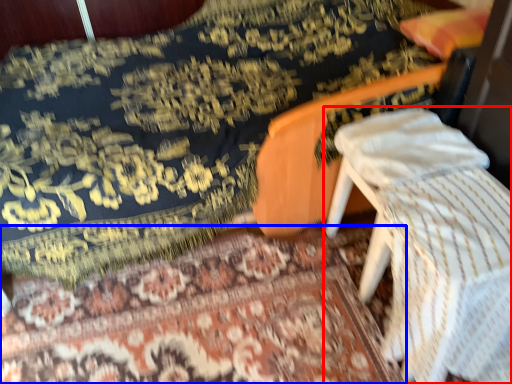
Question: Which point is further to the camera, furniture (highlighted by a red box) or mat (highlighted by a blue box)?

Choices:
 (A) furniture
 (B) mat

Answer: (B)